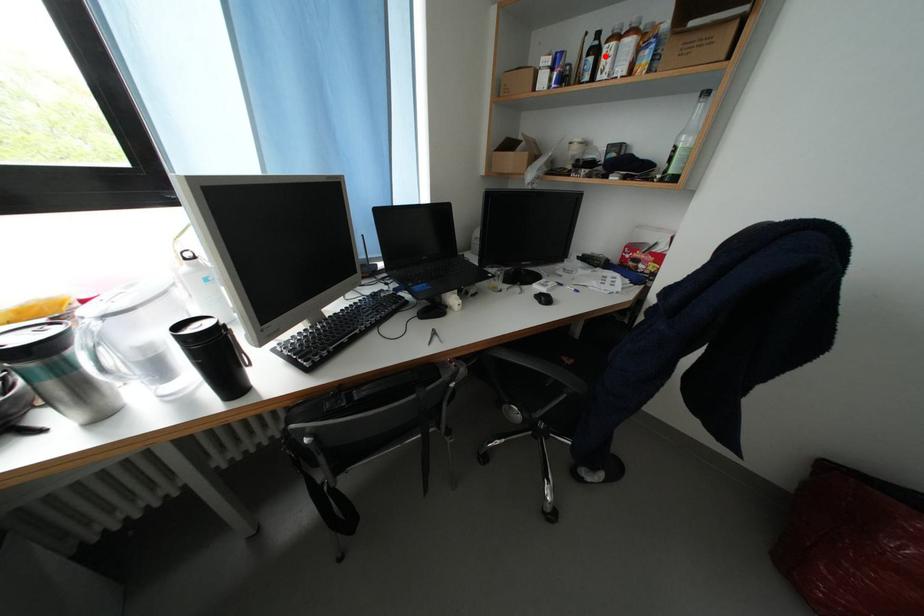
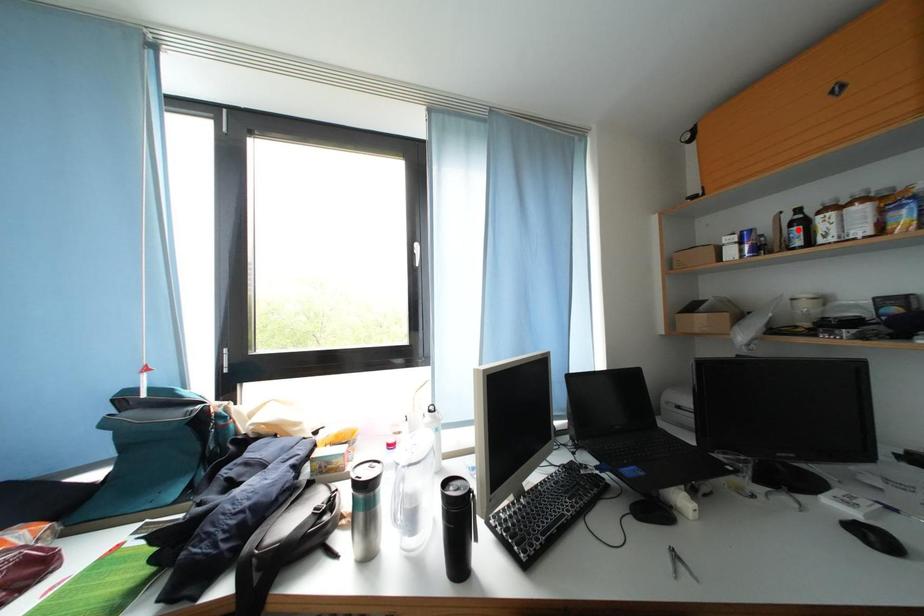
I am providing you with two images of the same scene from different viewpoints. A red point is marked on the first image and another point is marked on the second image. Is the red point in image1 aligned with the point shown in image2?

No